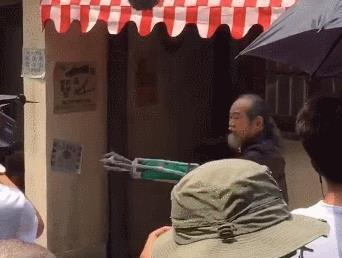
The image size is (342, 258). What are the coordinates of `paper sign` in the screenshot? It's located at (87, 103).